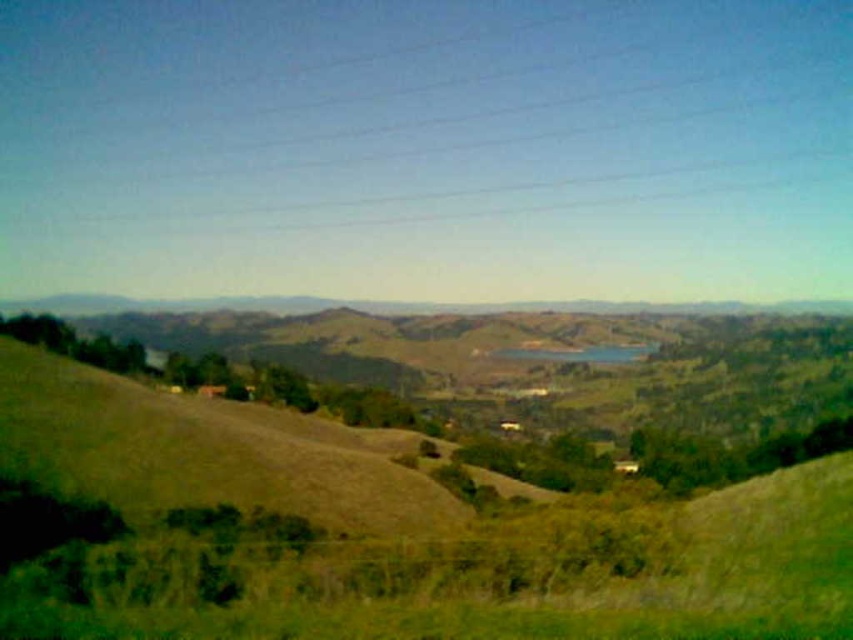
Question: Which of the following is the farthest from the observer?

Choices:
 (A) (519, 356)
 (B) (218, 630)

Answer: (A)

Question: From the image, what is the correct spatial relationship of green grassy hillside at lower center in relation to blue glass lake at center?

Choices:
 (A) right
 (B) left

Answer: (B)

Question: Can you confirm if green grassy hillside at lower center is positioned to the right of blue glass lake at center?

Choices:
 (A) no
 (B) yes

Answer: (A)

Question: Which object is closer to the camera taking this photo?

Choices:
 (A) green grassy hillside at lower center
 (B) blue glass lake at center

Answer: (A)

Question: Does green grassy hillside at lower center appear on the right side of blue glass lake at center?

Choices:
 (A) yes
 (B) no

Answer: (B)